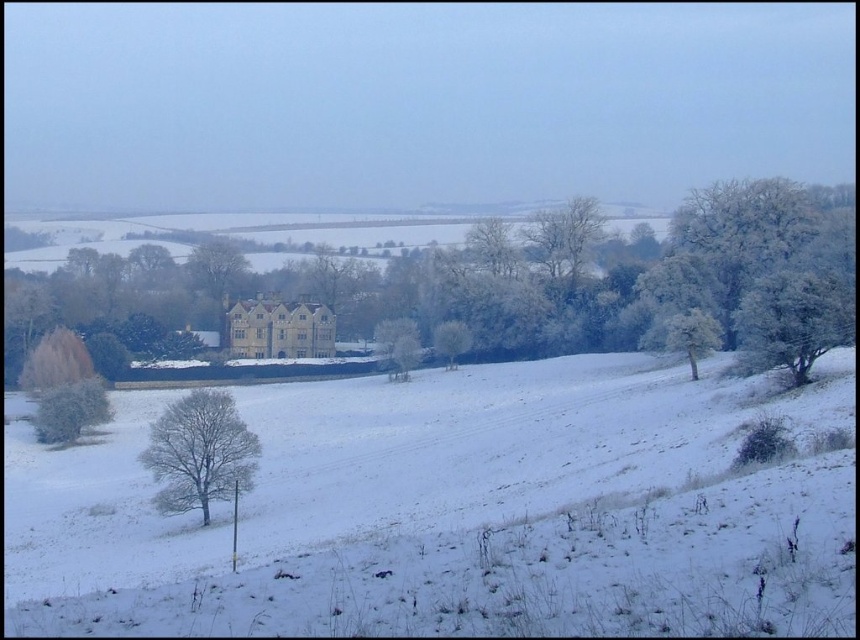
You are an animal looking for shelter in the frosted white tree at right and the green frosted bush at lower left. Which one offers more coverage?

The frosted white tree at right might be wider than green frosted bush at lower left, so it likely offers more coverage for shelter.

Consider the image. You are a hiker trying to navigate through the winter landscape. You see the white frosty tree at right and the white frosty tree at center. If you want to walk directly between them, how far apart are they?

The white frosty tree at right and the white frosty tree at center are 137.42 feet apart from each other, so the distance between them is 137.42 feet.

You are an artist planning to paint this winter scene. You want to ensure the green frosted bush at lower left and the white frosty tree at center are proportionally accurate. Which object should you make wider in your painting?

The green frosted bush at lower left should be made wider in the painting since its width surpasses that of the white frosty tree at center according to the description.